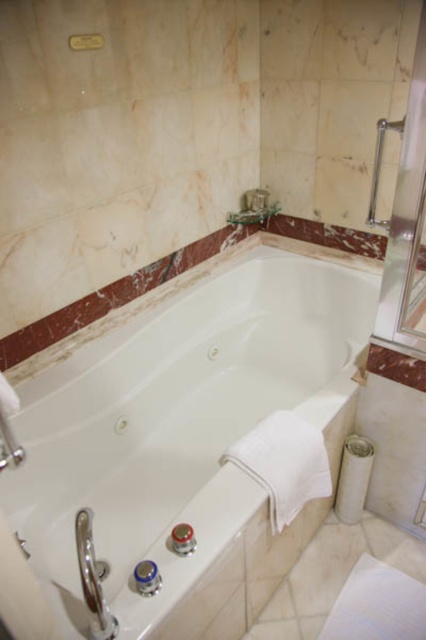
How much distance is there between white glossy bathtub at center and satin nickel grab bar at upper right?

white glossy bathtub at center and satin nickel grab bar at upper right are 30.03 inches apart from each other.

Is point (265, 266) farther from camera compared to point (370, 212)?

Yes, it is.

Between point (270, 588) and point (374, 216), which one is positioned behind?

The point (374, 216) is behind.

Locate an element on the screen. white glossy bathtub at center is located at coordinates (181, 445).

Between white glossy bathtub at center and transparent glass door at upper right, which one appears on the right side from the viewer's perspective?

Positioned to the right is transparent glass door at upper right.

Is white glossy bathtub at center bigger than transparent glass door at upper right?

Yes.

Does point (149, 321) come closer to viewer compared to point (396, 128)?

No, (149, 321) is behind (396, 128).

The image size is (426, 640). I want to click on white glossy bathtub at center, so click(181, 445).

Is transparent glass door at upper right taller than satin nickel grab bar at upper right?

Yes, transparent glass door at upper right is taller than satin nickel grab bar at upper right.

Is transparent glass door at upper right bigger than satin nickel grab bar at upper right?

Yes, transparent glass door at upper right is bigger than satin nickel grab bar at upper right.

Is point (400, 337) behind point (377, 148)?

Yes, it is behind point (377, 148).

In order to click on transparent glass door at upper right in this screenshot , I will do `click(403, 212)`.